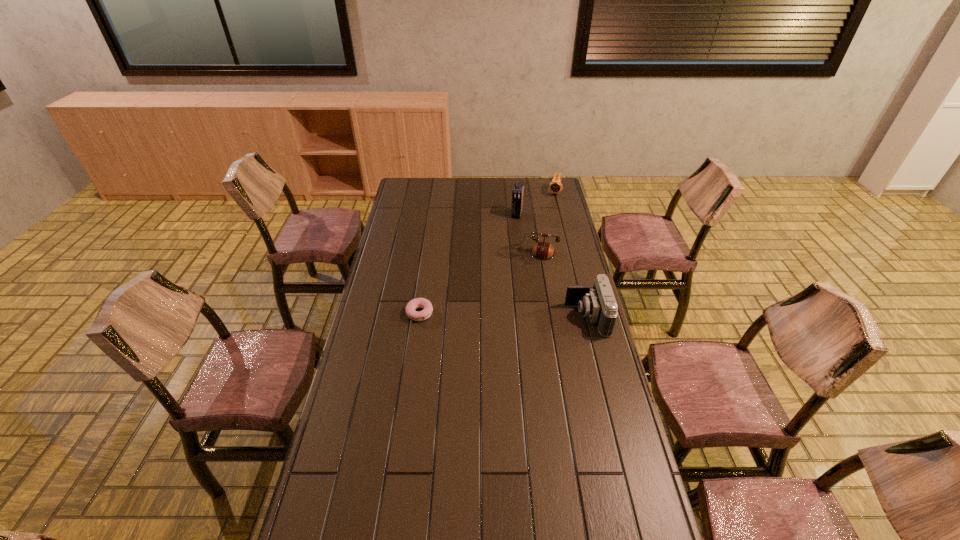
Identify the location of free space at the far left corner of the desktop. The height and width of the screenshot is (540, 960). (419, 195).

Find the location of a particular element. vacant space in between the watch and the third farthest object is located at coordinates (541, 223).

This screenshot has height=540, width=960. What are the coordinates of `free space between the farthest object and the leftmost object` in the screenshot? It's located at [x=487, y=253].

Find the location of a particular element. free space between the farthest object and the telephone is located at coordinates (541, 223).

This screenshot has width=960, height=540. Find the location of `vacant point located between the leftmost object and the telephone`. vacant point located between the leftmost object and the telephone is located at coordinates (474, 284).

You are a GUI agent. You are given a task and a screenshot of the screen. Output one action in this format:
    pyautogui.click(x=<x>, y=<y>)
    Task: Click on the empty space between the farthest object and the fourth shortest object
    
    Given the screenshot: What is the action you would take?
    pyautogui.click(x=571, y=255)

At what (x,y) coordinates should I click in order to perform the action: click on free space between the telephone and the fourth nearest object. Please return your answer as a coordinate pair (x, y). Looking at the image, I should click on (522, 234).

Locate an element on the screen. The image size is (960, 540). vacant area that lies between the doughnut and the third nearest object is located at coordinates (474, 284).

Find the location of a particular element. This screenshot has height=540, width=960. free spot between the shortest object and the third nearest object is located at coordinates (474, 284).

Image resolution: width=960 pixels, height=540 pixels. I want to click on vacant space that's between the tallest object and the watch, so click(x=536, y=204).